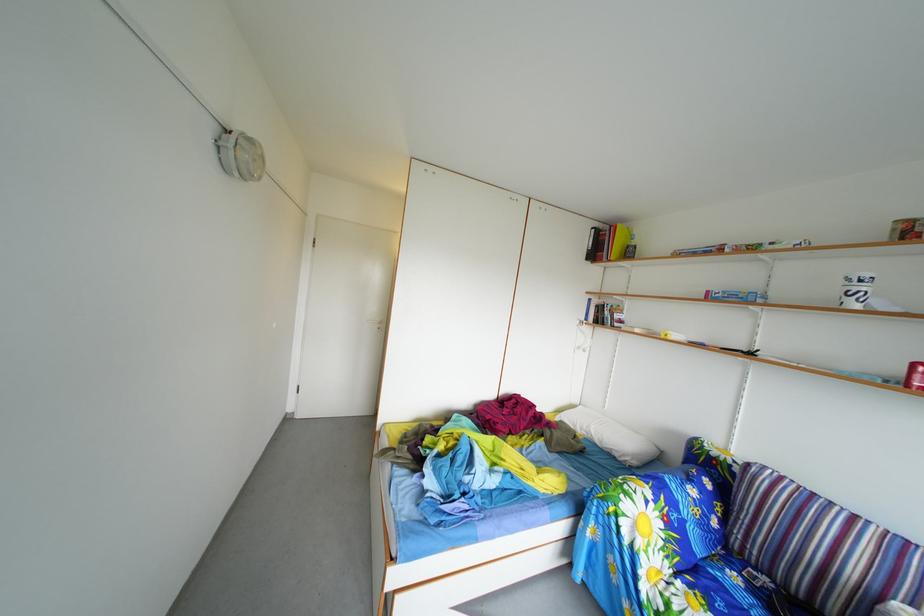
This screenshot has height=616, width=924. I want to click on sofa sitting surface, so click(739, 589).